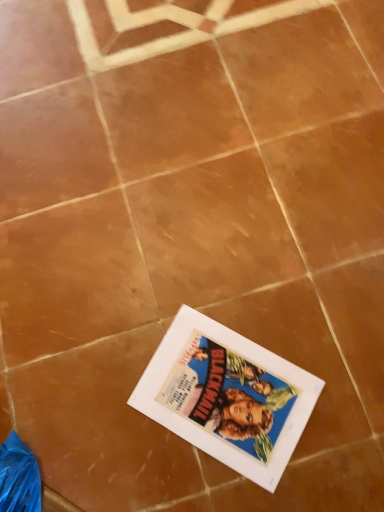
Where is `blank space situated above matte paper book cover at center (from a real-world perspective)`? This screenshot has width=384, height=512. blank space situated above matte paper book cover at center (from a real-world perspective) is located at coordinates (221, 393).